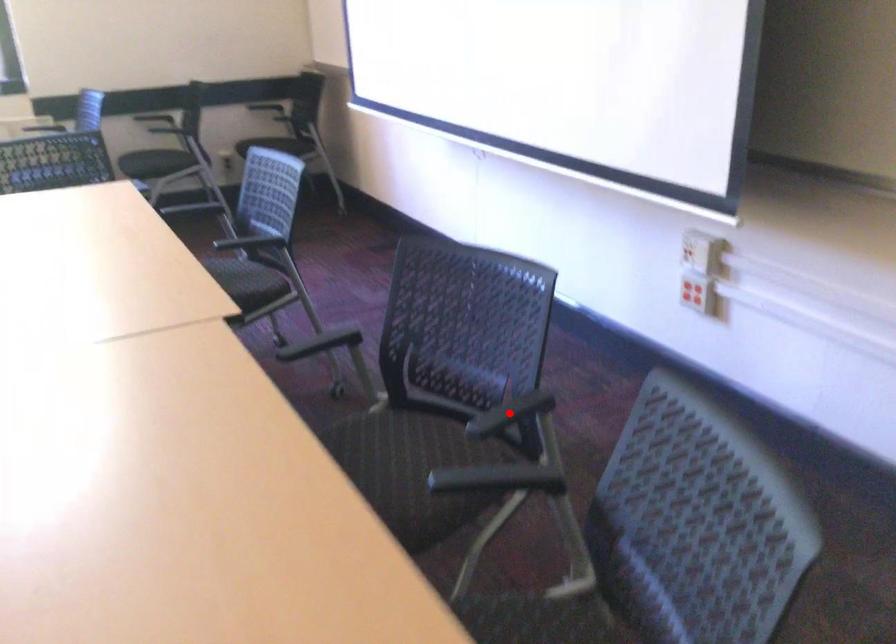
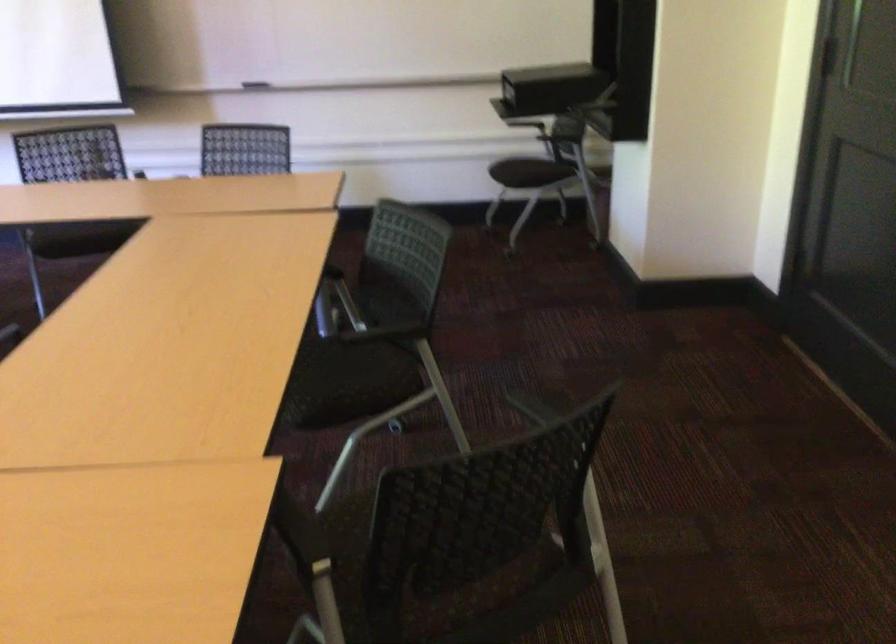
Question: I am providing you with two images of the same scene from different viewpoints. A red point is marked on the first image. At the location where the point appears in image 1, is it still visible in image 2?

Choices:
 (A) Yes
 (B) No

Answer: (B)